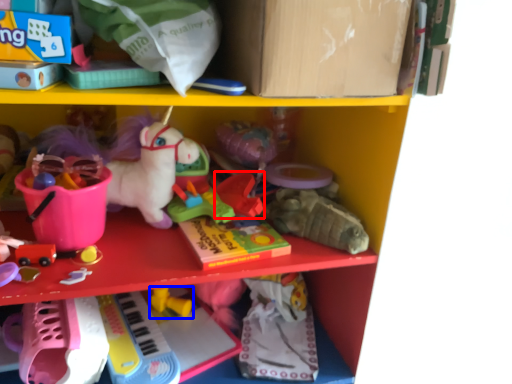
Question: Among these objects, which one is nearest to the camera, toy (highlighted by a red box) or toy (highlighted by a blue box)?

Choices:
 (A) toy
 (B) toy

Answer: (A)